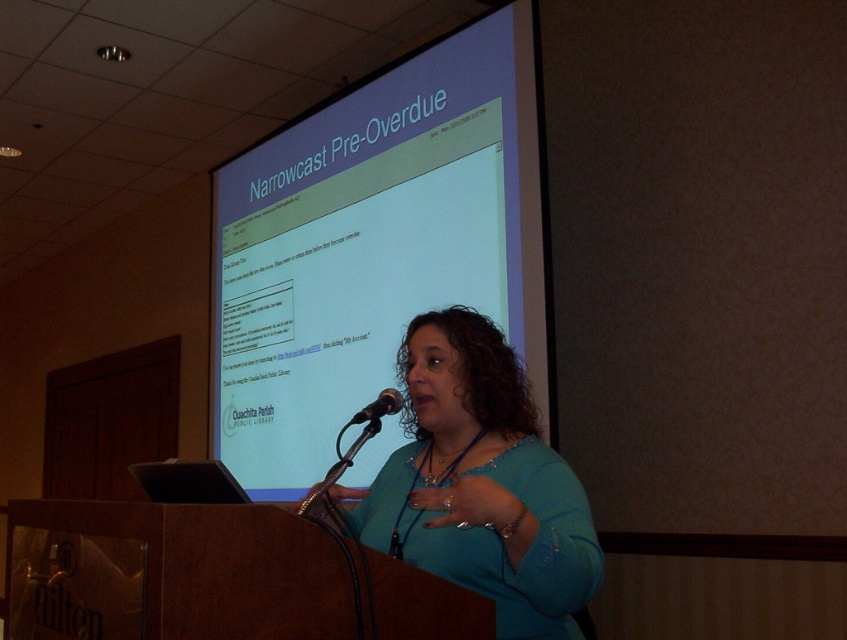
Is teal fabric shirt at center shorter than black metallic microphone at center?

No, teal fabric shirt at center is not shorter than black metallic microphone at center.

Is teal fabric shirt at center closer to the viewer compared to black metallic microphone at center?

Yes, it is.

The width and height of the screenshot is (847, 640). What do you see at coordinates (480, 483) in the screenshot? I see `teal fabric shirt at center` at bounding box center [480, 483].

The height and width of the screenshot is (640, 847). I want to click on teal fabric shirt at center, so click(x=480, y=483).

Is matte white projector screen at upper center thinner than teal fabric shirt at center?

No.

Who is lower down, matte white projector screen at upper center or teal fabric shirt at center?

teal fabric shirt at center is below.

Who is more forward, (x=493, y=257) or (x=502, y=456)?

Positioned in front is point (x=502, y=456).

Where is `matte white projector screen at upper center`? This screenshot has height=640, width=847. matte white projector screen at upper center is located at coordinates (374, 244).

Is matte white projector screen at upper center closer to camera compared to black metallic microphone at center?

No, it is not.

Which is more to the right, matte white projector screen at upper center or black metallic microphone at center?

From the viewer's perspective, black metallic microphone at center appears more on the right side.

Find the location of a particular element. This screenshot has height=640, width=847. matte white projector screen at upper center is located at coordinates (374, 244).

This screenshot has width=847, height=640. Identify the location of matte white projector screen at upper center. (374, 244).